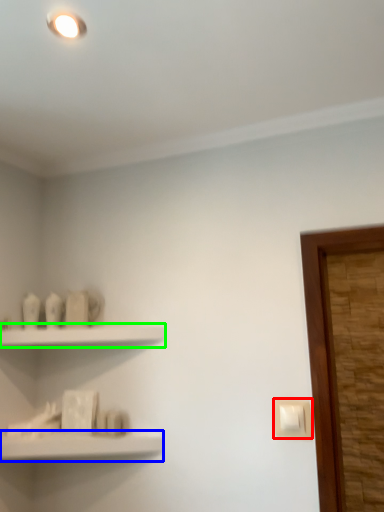
Question: Based on their relative distances, which object is farther from light switch (highlighted by a red box)? Choose from shelf (highlighted by a blue box) and shelf (highlighted by a green box).

Choices:
 (A) shelf
 (B) shelf

Answer: (B)